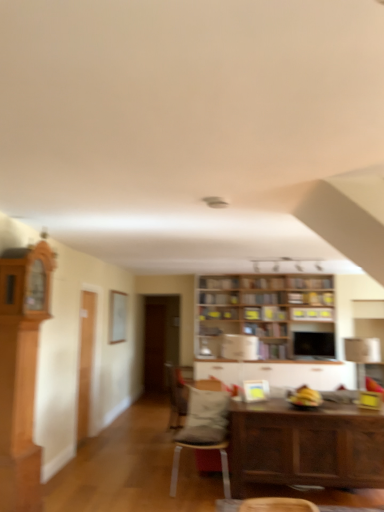
In order to face wooden bookshelf at center, which ranks as the fourth shelf in top-to-bottom order, should I rotate leftwards or rightwards?

Turn right approximately 9.799 degrees to face it.

What is the approximate width of wooden shelves at upper center, which is the third shelf in bottom-to-top order?

The width of wooden shelves at upper center, which is the third shelf in bottom-to-top order, is 3.36 inches.

The height and width of the screenshot is (512, 384). Describe the element at coordinates (312, 314) in the screenshot. I see `wooden shelves at upper center, which is the 2th shelf from top to bottom` at that location.

What is the approximate width of wooden bookshelf at center, the 4th shelf when ordered from bottom to top?

wooden bookshelf at center, the 4th shelf when ordered from bottom to top, is 6.65 inches in width.

Locate an element on the screen. The width and height of the screenshot is (384, 512). white glossy cabinet at center, which appears as the 1th cabinetry when viewed from the right is located at coordinates (280, 373).

What is the approximate height of wooden table at lower right?

wooden table at lower right is 30.21 inches in height.

Find the location of `light brown wood cabinet at left, the first cabinetry when ordered from top to bottom`. light brown wood cabinet at left, the first cabinetry when ordered from top to bottom is located at coordinates (21, 370).

Is matte gray cushioned chair at center, the second chair when ordered from back to front, aimed at wooden shelves at upper center, which is the third shelf in bottom-to-top order?

No, matte gray cushioned chair at center, the second chair when ordered from back to front, is not oriented towards wooden shelves at upper center, which is the third shelf in bottom-to-top order.

Consider the image. Measure the distance between matte gray cushioned chair at center, which is the 1th chair in front-to-back order, and wooden shelves at upper center, which is the 2th shelf from top to bottom.

matte gray cushioned chair at center, which is the 1th chair in front-to-back order, is 8.50 feet from wooden shelves at upper center, which is the 2th shelf from top to bottom.

Based on the photo, are matte gray cushioned chair at center, which is the 1th chair in front-to-back order, and wooden shelves at upper center, which is the 2th shelf from top to bottom, beside each other?

matte gray cushioned chair at center, which is the 1th chair in front-to-back order, is not next to wooden shelves at upper center, which is the 2th shelf from top to bottom, and they're not touching.

Would you say matte gray cushioned chair at center, the second chair when ordered from back to front, is outside wooden shelves at upper center, which is the third shelf in bottom-to-top order?

matte gray cushioned chair at center, the second chair when ordered from back to front, is positioned outside wooden shelves at upper center, which is the third shelf in bottom-to-top order.

Between point (172, 393) and point (197, 417), which one is positioned in front?

The point (197, 417) is closer.

Identify the location of chair that is the 2nd object located below the gray fabric pillow at center (from the image's perspective). The image size is (384, 512). (178, 392).

Are velvet gray chair at center, placed as the second chair when sorted from front to back, and gray fabric pillow at center beside each other?

velvet gray chair at center, placed as the second chair when sorted from front to back, is not next to gray fabric pillow at center, and they're not touching.

Considering the positions of point (200, 317) and point (281, 479), is point (200, 317) closer or farther from the camera than point (281, 479)?

Point (200, 317) is positioned farther from the camera compared to point (281, 479).

Find the location of a particular element. This screenshot has height=512, width=384. table on the right of wooden bookshelf at center, which is the second shelf in bottom-to-top order is located at coordinates (305, 446).

Is wooden bookshelf at center, the 3th shelf positioned from the top, touching wooden table at lower right?

wooden bookshelf at center, the 3th shelf positioned from the top, and wooden table at lower right are clearly separated.

Is wooden bookshelf at center, which ranks as the fourth shelf in top-to-bottom order, not close to light brown wood cabinet at left, the first cabinetry when ordered from top to bottom?

That's right, there is a large distance between wooden bookshelf at center, which ranks as the fourth shelf in top-to-bottom order, and light brown wood cabinet at left, the first cabinetry when ordered from top to bottom.

Is wooden bookshelf at center, the 1th shelf when ordered from bottom to top, aimed at light brown wood cabinet at left, the first cabinetry when ordered from top to bottom?

Yes, wooden bookshelf at center, the 1th shelf when ordered from bottom to top, is turned towards light brown wood cabinet at left, the first cabinetry when ordered from top to bottom.

From a real-world perspective, which object stands above the other?

In real-world perspective, wooden bookshelf at center, the 1th shelf when ordered from bottom to top, is above.

Which is more to the left, wooden bookshelf at center, which ranks as the fourth shelf in top-to-bottom order, or light brown wood cabinet at left, which is the 1th cabinetry in left-to-right order?

light brown wood cabinet at left, which is the 1th cabinetry in left-to-right order.

Does point (208, 293) come behind point (246, 373)?

Yes, point (208, 293) is behind point (246, 373).

Considering their positions, is wooden bookshelf at center, which ranks as the first shelf in top-to-bottom order, located in front of or behind white glossy cabinet at center, the first cabinetry when ordered from back to front?

Clearly, wooden bookshelf at center, which ranks as the first shelf in top-to-bottom order, is behind white glossy cabinet at center, the first cabinetry when ordered from back to front.

Is wooden bookshelf at center, which ranks as the first shelf in top-to-bottom order, positioned beyond the bounds of white glossy cabinet at center, which is counted as the second cabinetry, starting from the top?

Yes, wooden bookshelf at center, which ranks as the first shelf in top-to-bottom order, is not within white glossy cabinet at center, which is counted as the second cabinetry, starting from the top.

Between wooden bookshelf at center, which ranks as the first shelf in top-to-bottom order, and white glossy cabinet at center, which is counted as the second cabinetry, starting from the top, which one has more height?

white glossy cabinet at center, which is counted as the second cabinetry, starting from the top.

Would you consider wooden bookshelf at center, which ranks as the first shelf in top-to-bottom order, to be distant from matte gray cushioned chair at center, the second chair when ordered from back to front?

Yes, wooden bookshelf at center, which ranks as the first shelf in top-to-bottom order, and matte gray cushioned chair at center, the second chair when ordered from back to front, are quite far apart.

Consider the image. Which of these two, wooden bookshelf at center, which ranks as the first shelf in top-to-bottom order, or matte gray cushioned chair at center, which is the 1th chair in front-to-back order, stands shorter?

With less height is wooden bookshelf at center, which ranks as the first shelf in top-to-bottom order.

Which object is further away from the camera taking this photo, wooden bookshelf at center, which ranks as the first shelf in top-to-bottom order, or matte gray cushioned chair at center, the second chair when ordered from back to front?

wooden bookshelf at center, which ranks as the first shelf in top-to-bottom order, is further away from the camera.

Between wooden bookshelf at center, the 4th shelf when ordered from bottom to top, and matte gray cushioned chair at center, which is the 1th chair in front-to-back order, which one has larger size?

matte gray cushioned chair at center, which is the 1th chair in front-to-back order.

From the image's perspective, starting from the gray fabric pillow at center, which shelf is the 1st one above? Please provide its 2D coordinates.

[(271, 314)]

Is wooden bookshelf at center, the 1th shelf when ordered from bottom to top, far from gray fabric pillow at center?

wooden bookshelf at center, the 1th shelf when ordered from bottom to top, is positioned a significant distance from gray fabric pillow at center.

From the image's perspective, which is below, wooden bookshelf at center, the 1th shelf when ordered from bottom to top, or gray fabric pillow at center?

gray fabric pillow at center is shown below in the image.

Is wooden bookshelf at center, the 1th shelf when ordered from bottom to top, positioned before gray fabric pillow at center?

No, wooden bookshelf at center, the 1th shelf when ordered from bottom to top, is further to the viewer.

You are a GUI agent. You are given a task and a screenshot of the screen. Output one action in this format:
    pyautogui.click(x=<x>, y=<y>)
    Task: Click on the chair that is the 1st one when counting downward from the wooden shelves at upper center, which is the third shelf in bottom-to-top order (from the image's perspective)
    This screenshot has height=512, width=384.
    Given the screenshot: What is the action you would take?
    pyautogui.click(x=204, y=434)

This screenshot has height=512, width=384. Find the location of `pillow on the right of the velvet gray chair at center, placed as the second chair when sorted from front to back`. pillow on the right of the velvet gray chair at center, placed as the second chair when sorted from front to back is located at coordinates (205, 417).

Looking at the image, which one is located further to wooden bookshelf at center, which is the second shelf in bottom-to-top order, wooden bookshelf at center, the 1th shelf when ordered from bottom to top, or wooden bookshelf at center, which ranks as the first shelf in top-to-bottom order?

Among the two, wooden bookshelf at center, the 1th shelf when ordered from bottom to top, is located further to wooden bookshelf at center, which is the second shelf in bottom-to-top order.

Considering their positions, is wooden bookshelf at center, which ranks as the fourth shelf in top-to-bottom order, positioned closer to white glossy cabinet at center, which appears as the 1th cabinetry when viewed from the right, than wooden bookshelf at center, the 4th shelf when ordered from bottom to top?

wooden bookshelf at center, which ranks as the fourth shelf in top-to-bottom order, lies closer to white glossy cabinet at center, which appears as the 1th cabinetry when viewed from the right, than the other object.

Estimate the real-world distances between objects in this image. Which object is further from wooden table at lower right, light brown wood cabinet at left, the second cabinetry when ordered from back to front, or wooden bookshelf at center, the 1th shelf when ordered from bottom to top?

The object further to wooden table at lower right is wooden bookshelf at center, the 1th shelf when ordered from bottom to top.

Looking at this image, based on their spatial positions, is wooden shelves at upper center, which is the third shelf in bottom-to-top order, or wooden bookshelf at center, the 4th shelf when ordered from bottom to top, closer to wooden bookshelf at center, the 3th shelf positioned from the top?

wooden bookshelf at center, the 4th shelf when ordered from bottom to top, lies closer to wooden bookshelf at center, the 3th shelf positioned from the top, than the other object.

Based on their spatial positions, is wooden bookshelf at center, the 1th shelf when ordered from bottom to top, or wooden table at lower right closer to gray fabric pillow at center?

wooden table at lower right is positioned closer to the anchor gray fabric pillow at center.

Based on their spatial positions, is matte gray cushioned chair at center, the second chair when ordered from back to front, or velvet gray chair at center, placed as the second chair when sorted from front to back, closer to wooden bookshelf at center, the 4th shelf when ordered from bottom to top?

velvet gray chair at center, placed as the second chair when sorted from front to back.

Considering their positions, is wooden shelves at upper center, which is the 2th shelf from top to bottom, positioned further to gray fabric pillow at center than wooden bookshelf at center, which ranks as the fourth shelf in top-to-bottom order?

wooden shelves at upper center, which is the 2th shelf from top to bottom, is positioned further to the anchor gray fabric pillow at center.

From the image, which object appears to be farther from light brown wood cabinet at left, the second cabinetry when ordered from back to front, velvet gray chair at center, placed as the second chair when sorted from front to back, or matte gray cushioned chair at center, the second chair when ordered from back to front?

velvet gray chair at center, placed as the second chair when sorted from front to back, lies further to light brown wood cabinet at left, the second cabinetry when ordered from back to front, than the other object.

Where is `table between light brown wood cabinet at left, marked as the 2th cabinetry in a bottom-to-top arrangement, and wooden bookshelf at center, the 4th shelf when ordered from bottom to top, along the z-axis`? This screenshot has height=512, width=384. table between light brown wood cabinet at left, marked as the 2th cabinetry in a bottom-to-top arrangement, and wooden bookshelf at center, the 4th shelf when ordered from bottom to top, along the z-axis is located at coordinates (305, 446).

Locate an element on the screen. The height and width of the screenshot is (512, 384). cabinetry between light brown wood cabinet at left, the second cabinetry when ordered from back to front, and wooden bookshelf at center, which is the second shelf in bottom-to-top order, from front to back is located at coordinates (280, 373).

The height and width of the screenshot is (512, 384). Find the location of `pillow between matte gray cushioned chair at center, which is the 1th chair in front-to-back order, and wooden shelves at upper center, which is the third shelf in bottom-to-top order, in the front-back direction`. pillow between matte gray cushioned chair at center, which is the 1th chair in front-to-back order, and wooden shelves at upper center, which is the third shelf in bottom-to-top order, in the front-back direction is located at coordinates (205, 417).

Where is `chair positioned between gray fabric pillow at center and wooden bookshelf at center, the 1th shelf when ordered from bottom to top, from near to far`? This screenshot has height=512, width=384. chair positioned between gray fabric pillow at center and wooden bookshelf at center, the 1th shelf when ordered from bottom to top, from near to far is located at coordinates (178, 392).